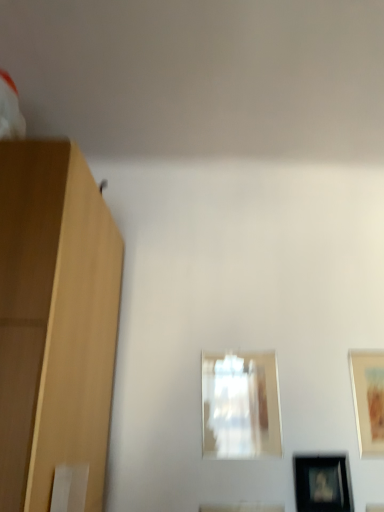
Question: Is transparent glass picture frame at center, which is the 3th picture frame from right to left, thinner than black glossy picture frame at lower right, the 2th picture frame when ordered from left to right?

Choices:
 (A) yes
 (B) no

Answer: (A)

Question: From a real-world perspective, is transparent glass picture frame at center, the 1th picture frame positioned from the left, beneath black glossy picture frame at lower right, positioned as the second picture frame in right-to-left order?

Choices:
 (A) yes
 (B) no

Answer: (B)

Question: Can you confirm if transparent glass picture frame at center, which is the 3th picture frame from right to left, is positioned to the right of black glossy picture frame at lower right, positioned as the second picture frame in right-to-left order?

Choices:
 (A) yes
 (B) no

Answer: (B)

Question: Is black glossy picture frame at lower right, the 2th picture frame when ordered from left to right, a part of transparent glass picture frame at center, which is the 3th picture frame from right to left?

Choices:
 (A) no
 (B) yes

Answer: (A)

Question: From the image's perspective, is transparent glass picture frame at center, the 1th picture frame positioned from the left, on top of black glossy picture frame at lower right, the 2th picture frame when ordered from left to right?

Choices:
 (A) no
 (B) yes

Answer: (B)

Question: Considering the relative sizes of transparent glass picture frame at center, which is the 3th picture frame from right to left, and black glossy picture frame at lower right, the 2th picture frame when ordered from left to right, in the image provided, is transparent glass picture frame at center, which is the 3th picture frame from right to left, wider than black glossy picture frame at lower right, the 2th picture frame when ordered from left to right,?

Choices:
 (A) yes
 (B) no

Answer: (B)

Question: Is matte wooden picture frame at right, which ranks as the 1th picture frame in right-to-left order, smaller than black glossy picture frame at lower right, the 2th picture frame when ordered from left to right?

Choices:
 (A) no
 (B) yes

Answer: (A)

Question: Does matte wooden picture frame at right, placed as the 3th picture frame when sorted from left to right, come behind black glossy picture frame at lower right, positioned as the second picture frame in right-to-left order?

Choices:
 (A) yes
 (B) no

Answer: (A)

Question: Is matte wooden picture frame at right, placed as the 3th picture frame when sorted from left to right, oriented away from black glossy picture frame at lower right, positioned as the second picture frame in right-to-left order?

Choices:
 (A) yes
 (B) no

Answer: (B)

Question: Is matte wooden picture frame at right, which ranks as the 1th picture frame in right-to-left order, not near black glossy picture frame at lower right, the 2th picture frame when ordered from left to right?

Choices:
 (A) yes
 (B) no

Answer: (B)

Question: From a real-world perspective, is matte wooden picture frame at right, which ranks as the 1th picture frame in right-to-left order, below black glossy picture frame at lower right, positioned as the second picture frame in right-to-left order?

Choices:
 (A) no
 (B) yes

Answer: (A)

Question: Is matte wooden picture frame at right, which ranks as the 1th picture frame in right-to-left order, taller than black glossy picture frame at lower right, positioned as the second picture frame in right-to-left order?

Choices:
 (A) no
 (B) yes

Answer: (B)

Question: Considering the relative positions of black glossy picture frame at lower right, the 2th picture frame when ordered from left to right, and matte wooden picture frame at right, which ranks as the 1th picture frame in right-to-left order, in the image provided, is black glossy picture frame at lower right, the 2th picture frame when ordered from left to right, in front of matte wooden picture frame at right, which ranks as the 1th picture frame in right-to-left order,?

Choices:
 (A) no
 (B) yes

Answer: (B)